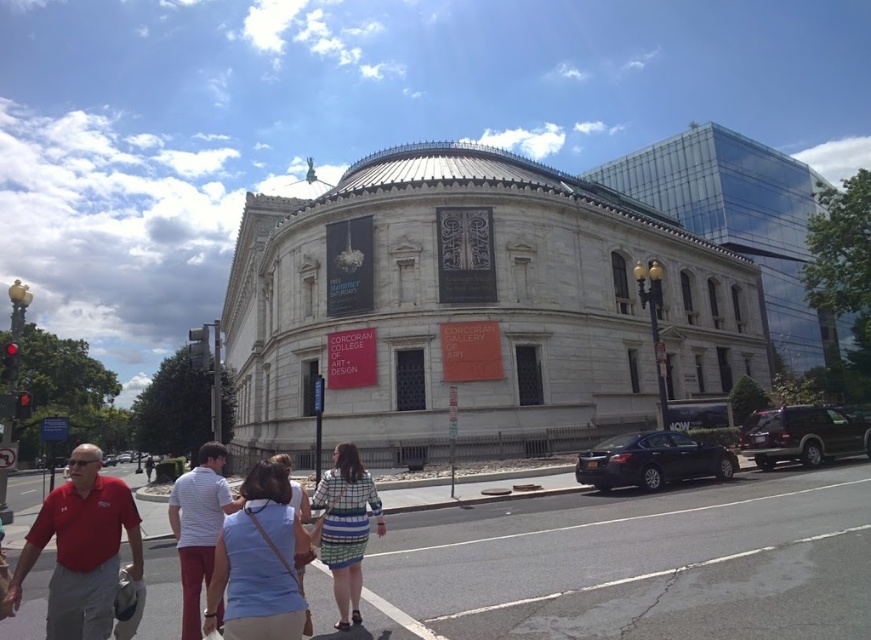
In the scene shown: Can you confirm if striped cotton shirt at lower left is taller than light blue denim shirt at center?

Incorrect, striped cotton shirt at lower left's height is not larger of light blue denim shirt at center's.

Locate an element on the screen. The image size is (871, 640). striped cotton shirt at lower left is located at coordinates (198, 525).

In order to click on striped cotton shirt at lower left in this screenshot , I will do `click(198, 525)`.

Can you confirm if shiny black sedan at lower right is positioned to the left of white striped shirt at center?

No, shiny black sedan at lower right is not to the left of white striped shirt at center.

Based on the photo, how far apart are shiny black sedan at lower right and white striped shirt at center?

shiny black sedan at lower right and white striped shirt at center are 48.88 meters apart from each other.

Which is in front, point (711, 460) or point (147, 470)?

Point (711, 460)

This screenshot has height=640, width=871. I want to click on shiny black sedan at lower right, so click(652, 460).

Who is more forward, (214, 620) or (814, 417)?

Point (214, 620)

Between striped fabric dress at lower center and shiny dark brown suv at right, which one is positioned higher?

striped fabric dress at lower center

Between point (277, 525) and point (817, 422), which one is positioned behind?

The point (817, 422) is more distant.

The height and width of the screenshot is (640, 871). Identify the location of striped fabric dress at lower center. (260, 563).